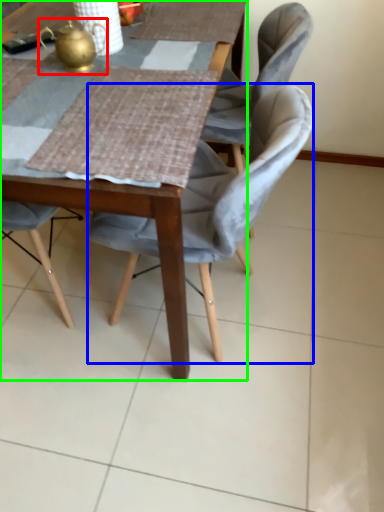
Question: Based on their relative distances, which object is nearer to tea pot (highlighted by a red box)? Choose from chair (highlighted by a blue box) and table (highlighted by a green box).

Choices:
 (A) chair
 (B) table

Answer: (A)